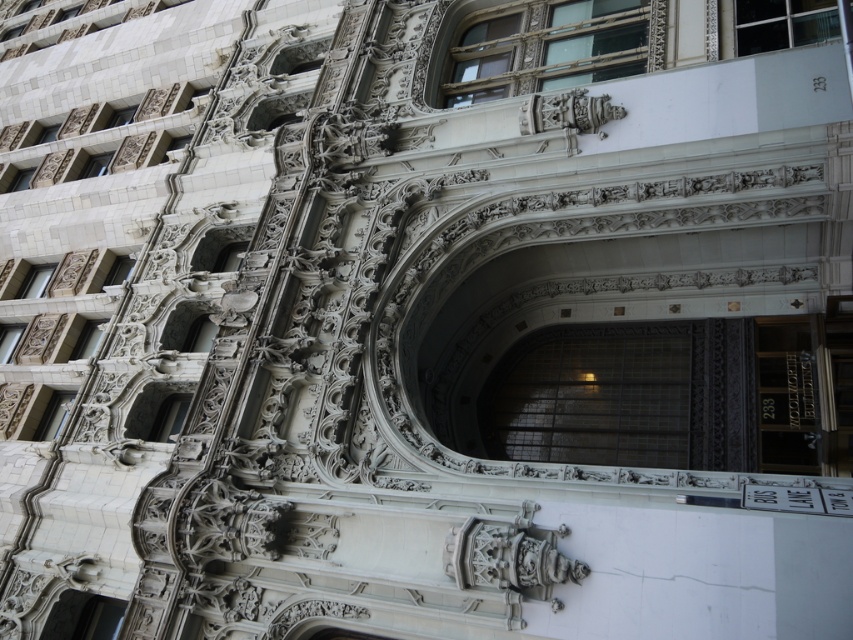
Question: Is black glass door at center wider than matte glass door at lower left?

Choices:
 (A) yes
 (B) no

Answer: (A)

Question: Can you confirm if black glass door at center is smaller than matte glass door at lower left?

Choices:
 (A) no
 (B) yes

Answer: (A)

Question: Can you confirm if black glass door at center is positioned above matte glass door at lower left?

Choices:
 (A) no
 (B) yes

Answer: (B)

Question: Among these points, which one is farthest from the camera?

Choices:
 (A) (97, 632)
 (B) (763, 385)

Answer: (B)